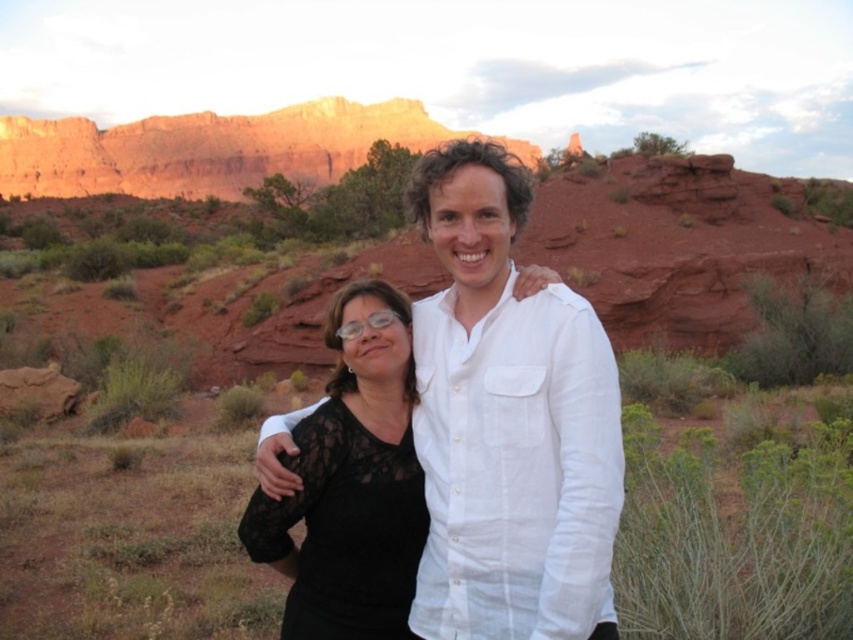
Question: Which of the following is the farthest from the observer?

Choices:
 (A) (589, 528)
 (B) (410, 390)

Answer: (B)

Question: Which of the following is the closest to the observer?

Choices:
 (A) black lace dress at center
 (B) black lace top at center

Answer: (A)

Question: Does black lace dress at center lie behind black lace top at center?

Choices:
 (A) yes
 (B) no

Answer: (B)

Question: Does black lace dress at center come in front of black lace top at center?

Choices:
 (A) yes
 (B) no

Answer: (A)

Question: Does black lace dress at center appear on the right side of black lace top at center?

Choices:
 (A) yes
 (B) no

Answer: (A)